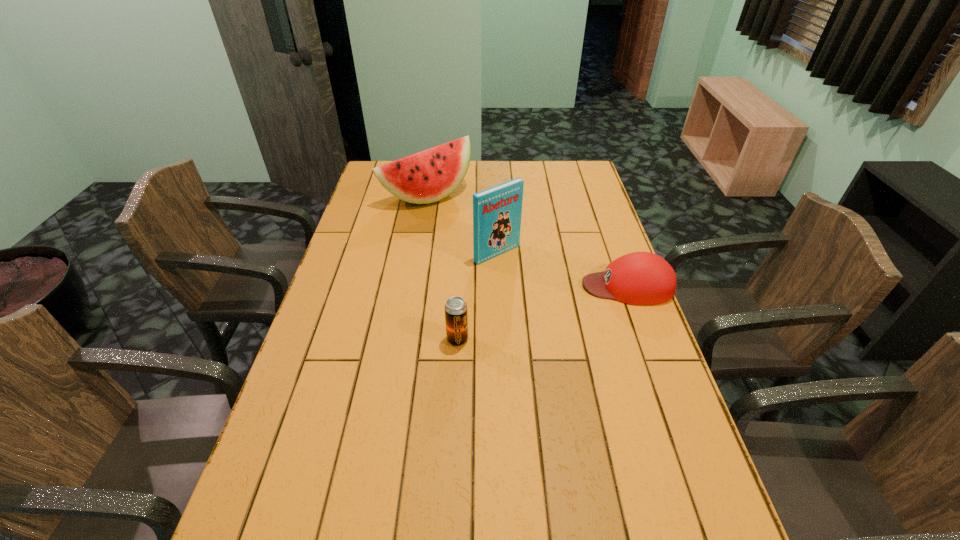
This screenshot has width=960, height=540. Find the location of `object at the right edge`. object at the right edge is located at coordinates (640, 278).

This screenshot has height=540, width=960. I want to click on object that is at the far left corner, so click(429, 176).

In the image, there is a desktop. At what (x,y) coordinates should I click in order to perform the action: click on blank space at the far edge. Please return your answer as a coordinate pair (x, y). Looking at the image, I should click on (534, 169).

Identify the location of blank area at the left edge. This screenshot has width=960, height=540. (332, 357).

Where is `free location at the right edge`? free location at the right edge is located at coordinates coord(635,402).

Identify the location of free space at the far right corner of the desktop. (584, 164).

You are a GUI agent. You are given a task and a screenshot of the screen. Output one action in this format:
    pyautogui.click(x=<x>, y=<y>)
    Task: Click on the blank region between the baseball cap and the tallest object
    This screenshot has height=540, width=960.
    Given the screenshot: What is the action you would take?
    pyautogui.click(x=563, y=269)

Where is `vacant point located between the second farthest object and the nearest object`? The width and height of the screenshot is (960, 540). vacant point located between the second farthest object and the nearest object is located at coordinates (477, 296).

This screenshot has width=960, height=540. Find the location of `vacant point located between the farthest object and the beer can`. vacant point located between the farthest object and the beer can is located at coordinates (443, 268).

I want to click on empty location between the third shortest object and the book, so click(462, 225).